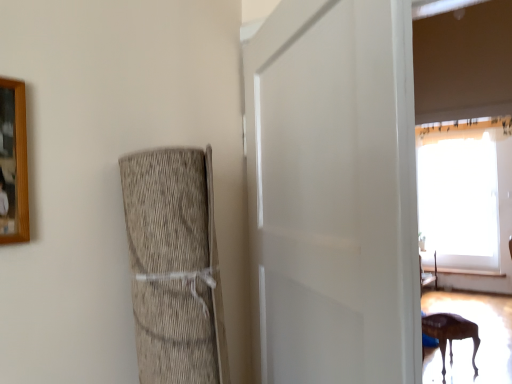
Question: From a real-world perspective, is white matte door at center on wooden picture frame at upper left?

Choices:
 (A) no
 (B) yes

Answer: (A)

Question: Does white matte door at center appear on the right side of wooden picture frame at upper left?

Choices:
 (A) no
 (B) yes

Answer: (B)

Question: Is white matte door at center in contact with wooden picture frame at upper left?

Choices:
 (A) yes
 (B) no

Answer: (B)

Question: Is white matte door at center facing towards wooden picture frame at upper left?

Choices:
 (A) yes
 (B) no

Answer: (A)

Question: Is white matte door at center positioned behind wooden picture frame at upper left?

Choices:
 (A) yes
 (B) no

Answer: (B)

Question: Is point (478, 342) positioned closer to the camera than point (325, 288)?

Choices:
 (A) closer
 (B) farther

Answer: (B)

Question: From a real-world perspective, is wooden table at lower right physically located above or below white matte door at center?

Choices:
 (A) below
 (B) above

Answer: (A)

Question: Considering the relative positions of wooden table at lower right and white matte door at center in the image provided, is wooden table at lower right to the left or to the right of white matte door at center?

Choices:
 (A) right
 (B) left

Answer: (A)

Question: In terms of size, does wooden table at lower right appear bigger or smaller than white matte door at center?

Choices:
 (A) big
 (B) small

Answer: (B)

Question: Considering the positions of wooden picture frame at upper left and wooden table at lower right in the image, is wooden picture frame at upper left bigger or smaller than wooden table at lower right?

Choices:
 (A) big
 (B) small

Answer: (B)

Question: Is wooden picture frame at upper left situated inside wooden table at lower right or outside?

Choices:
 (A) inside
 (B) outside

Answer: (B)

Question: From a real-world perspective, is wooden picture frame at upper left positioned above or below wooden table at lower right?

Choices:
 (A) below
 (B) above

Answer: (B)

Question: From the image's perspective, is wooden picture frame at upper left above or below wooden table at lower right?

Choices:
 (A) above
 (B) below

Answer: (A)

Question: Considering the positions of wooden picture frame at upper left and white matte door at center in the image, is wooden picture frame at upper left bigger or smaller than white matte door at center?

Choices:
 (A) big
 (B) small

Answer: (B)

Question: Choose the correct answer: Is wooden picture frame at upper left inside white matte door at center or outside it?

Choices:
 (A) outside
 (B) inside

Answer: (A)